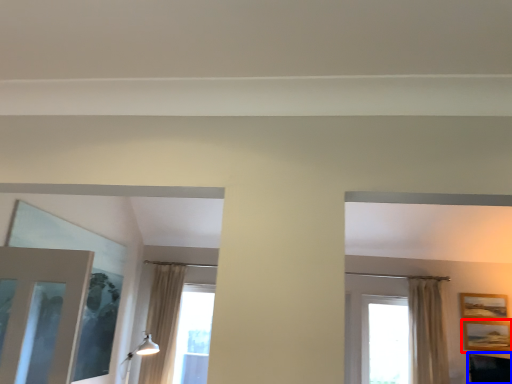
Question: Which of the following is the closest to the observer, picture frame (highlighted by a red box) or furniture (highlighted by a blue box)?

Choices:
 (A) picture frame
 (B) furniture

Answer: (B)